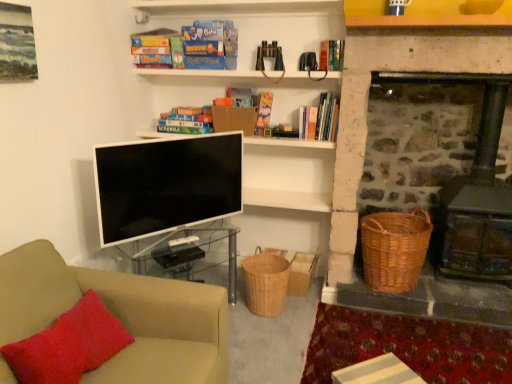
At what (x,y) coordinates should I click in order to perform the action: click on free location above white striped wood table at lower center (from a real-world perspective). Please return your answer as a coordinate pair (x, y). This screenshot has height=384, width=512. Looking at the image, I should click on (385, 374).